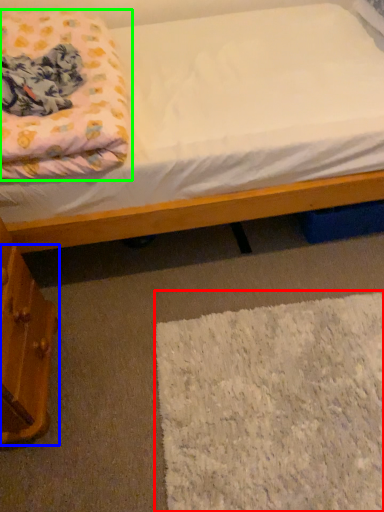
Question: Estimate the real-world distances between objects in this image. Which object is closer to mat (highlighted by a red box), drawer (highlighted by a blue box) or blanket (highlighted by a green box)?

Choices:
 (A) drawer
 (B) blanket

Answer: (A)